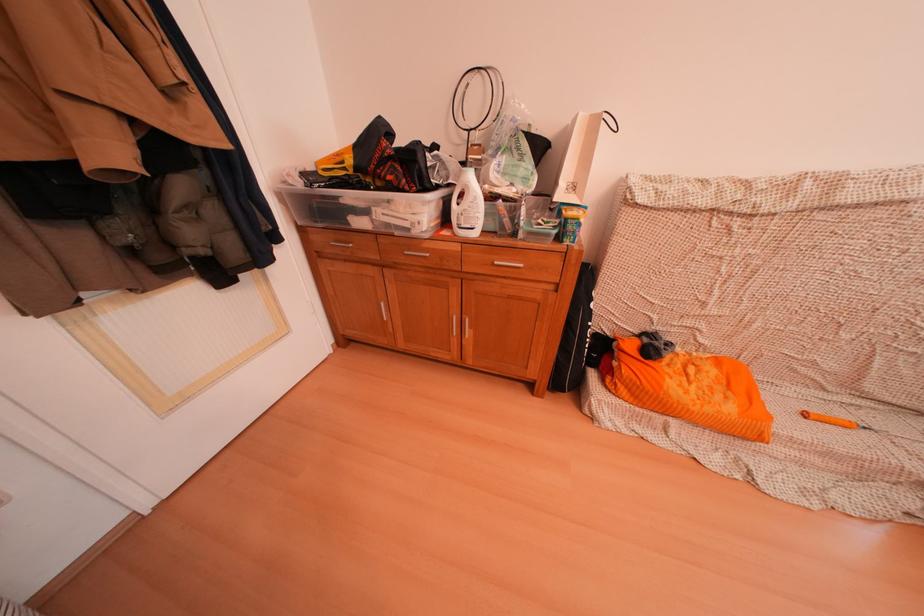
Where would you grip the orange handled tool? Please return your answer as a coordinate pair (x, y).

(833, 419)